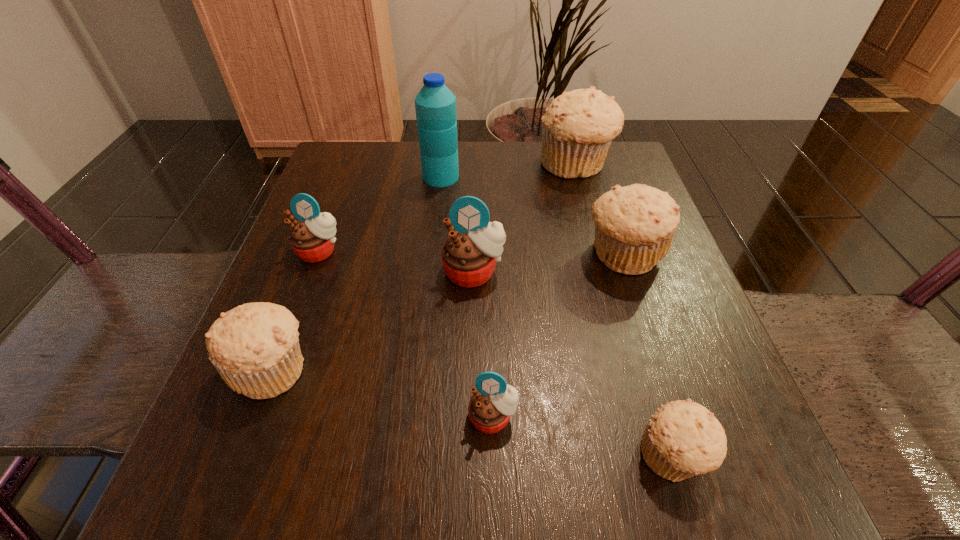
Locate an element on the screen. This screenshot has height=540, width=960. water bottle is located at coordinates (435, 105).

Identify the location of the tallest object. (435, 105).

Locate an element on the screen. Image resolution: width=960 pixels, height=540 pixels. the biggest beige muffin is located at coordinates (577, 129).

Identify the location of the farthest beige muffin. Image resolution: width=960 pixels, height=540 pixels. (577, 129).

Find the location of a particular element. The width and height of the screenshot is (960, 540). the biggest pink muffin is located at coordinates (469, 255).

This screenshot has width=960, height=540. In order to click on the third smallest beige muffin in this screenshot , I will do `click(635, 225)`.

The height and width of the screenshot is (540, 960). Find the location of `the second smallest pink muffin`. the second smallest pink muffin is located at coordinates (312, 238).

Where is `the second smallest beige muffin`? The height and width of the screenshot is (540, 960). the second smallest beige muffin is located at coordinates (255, 348).

I want to click on the leftmost beige muffin, so click(255, 348).

Identify the location of the smallest pink muffin. (491, 405).